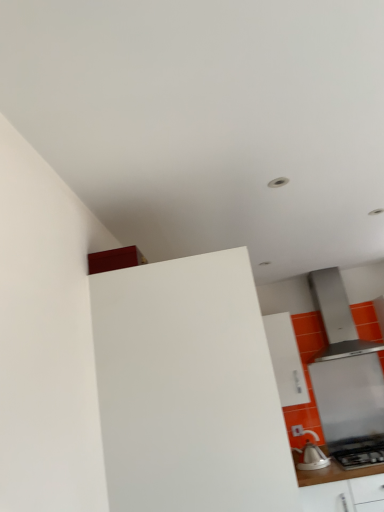
Question: Which direction should I rotate to look at white glossy cabinet at upper center, acting as the second cabinetry starting from the left?

Choices:
 (A) right
 (B) left

Answer: (A)

Question: Does satin silver range hood at right turn towards white glossy cabinet at upper center, marked as the 2th cabinetry in a front-to-back arrangement?

Choices:
 (A) no
 (B) yes

Answer: (A)

Question: Does satin silver range hood at right contain white glossy cabinet at upper center, marked as the 2th cabinetry in a front-to-back arrangement?

Choices:
 (A) no
 (B) yes

Answer: (A)

Question: Would you say satin silver range hood at right is outside white glossy cabinet at upper center, acting as the second cabinetry starting from the left?

Choices:
 (A) yes
 (B) no

Answer: (A)

Question: Can you confirm if satin silver range hood at right is smaller than white glossy cabinet at upper center, acting as the second cabinetry starting from the left?

Choices:
 (A) no
 (B) yes

Answer: (B)

Question: Is satin silver range hood at right thinner than white glossy cabinet at upper center, the first cabinetry positioned from the right?

Choices:
 (A) no
 (B) yes

Answer: (B)

Question: Is satin silver range hood at right positioned with its back to white glossy cabinet at upper center, the first cabinetry positioned from the right?

Choices:
 (A) no
 (B) yes

Answer: (A)

Question: From a real-world perspective, is satin silver range hood at upper right located higher than white glossy counter at lower right?

Choices:
 (A) no
 (B) yes

Answer: (B)

Question: Is satin silver range hood at upper right outside of white glossy counter at lower right?

Choices:
 (A) yes
 (B) no

Answer: (A)

Question: Would you say white glossy counter at lower right is part of satin silver range hood at upper right's contents?

Choices:
 (A) yes
 (B) no

Answer: (B)

Question: Can you confirm if satin silver range hood at upper right is bigger than white glossy counter at lower right?

Choices:
 (A) no
 (B) yes

Answer: (A)

Question: Considering the relative sizes of satin silver range hood at upper right and white glossy counter at lower right in the image provided, is satin silver range hood at upper right smaller than white glossy counter at lower right?

Choices:
 (A) no
 (B) yes

Answer: (B)

Question: Considering the relative positions of satin silver range hood at upper right and white glossy counter at lower right in the image provided, is satin silver range hood at upper right to the right of white glossy counter at lower right from the viewer's perspective?

Choices:
 (A) no
 (B) yes

Answer: (B)

Question: Is white glossy kettle at lower right inside white matte cabinet at center, which is the 1th cabinetry in left-to-right order?

Choices:
 (A) no
 (B) yes

Answer: (A)